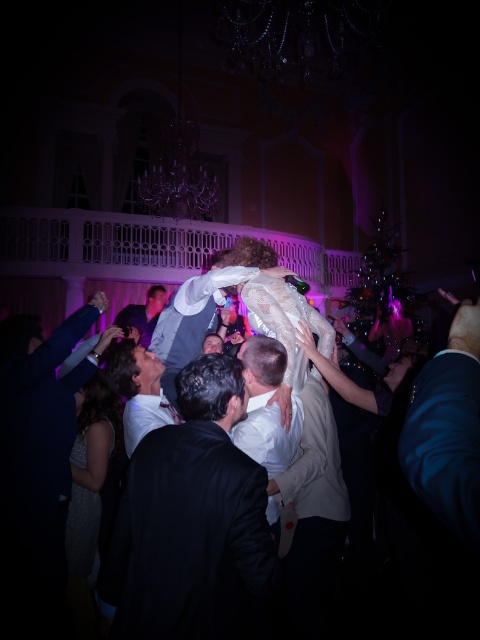
Measure the distance between point (252,323) and camera.

The distance of point (252,323) from camera is 3.36 meters.

This screenshot has height=640, width=480. Find the location of `lace dress at center`. lace dress at center is located at coordinates (278, 316).

Is point (248, 298) farther from camera compared to point (262, 397)?

Yes, point (248, 298) is farther from viewer.

The height and width of the screenshot is (640, 480). Find the location of `lace dress at center`. lace dress at center is located at coordinates (278, 316).

Who is taller, white satin dress at center or white shirt at center?

With more height is white satin dress at center.

Who is higher up, white satin dress at center or white shirt at center?

white shirt at center

You are a GUI agent. You are given a task and a screenshot of the screen. Output one action in this format:
    pyautogui.click(x=<x>, y=<y>)
    Task: Click on the white satin dress at center
    
    Given the screenshot: What is the action you would take?
    pyautogui.click(x=434, y=464)

I want to click on white satin dress at center, so click(x=434, y=464).

Is dark suit at center taller than dark blue suit at lower left?

Incorrect, dark suit at center's height is not larger of dark blue suit at lower left's.

Between dark suit at center and dark blue suit at lower left, which one is positioned higher?

dark suit at center is higher up.

This screenshot has height=640, width=480. Identify the location of dark suit at center. (191, 518).